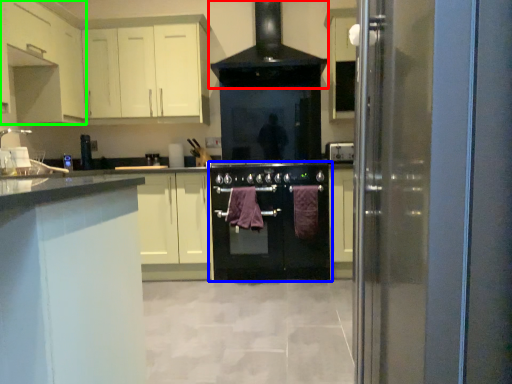
Question: Which object is positioned farthest from home appliance (highlighted by a red box)? Select from oven (highlighted by a blue box) and cabinetry (highlighted by a green box).

Choices:
 (A) oven
 (B) cabinetry

Answer: (B)